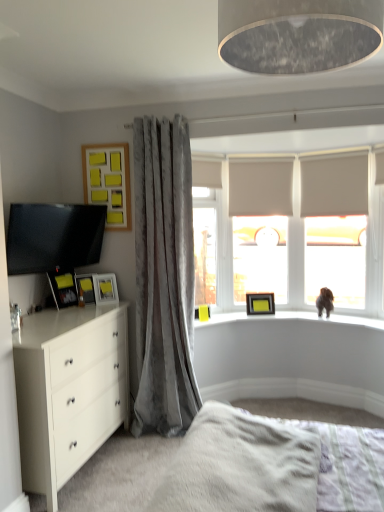
Question: Is matte black tv at left to the right of white fluffy bed at lower center from the viewer's perspective?

Choices:
 (A) yes
 (B) no

Answer: (B)

Question: Does matte black tv at left have a greater height compared to white fluffy bed at lower center?

Choices:
 (A) yes
 (B) no

Answer: (A)

Question: Does matte black tv at left contain white fluffy bed at lower center?

Choices:
 (A) yes
 (B) no

Answer: (B)

Question: From the image's perspective, is matte black tv at left below white fluffy bed at lower center?

Choices:
 (A) yes
 (B) no

Answer: (B)

Question: Is matte black tv at left next to white fluffy bed at lower center and touching it?

Choices:
 (A) yes
 (B) no

Answer: (B)

Question: Considering the positions of velvet gray curtain at left and matte black tv at left in the image, is velvet gray curtain at left wider or thinner than matte black tv at left?

Choices:
 (A) thin
 (B) wide

Answer: (B)

Question: Is point (147, 164) positioned closer to the camera than point (104, 212)?

Choices:
 (A) farther
 (B) closer

Answer: (B)

Question: From a real-world perspective, is velvet gray curtain at left physically located above or below matte black tv at left?

Choices:
 (A) above
 (B) below

Answer: (B)

Question: From the image's perspective, is velvet gray curtain at left positioned above or below matte black tv at left?

Choices:
 (A) above
 (B) below

Answer: (B)

Question: From a real-world perspective, is matte black tv at left above or below matte black picture frame at left, which appears as the fifth picture frame when viewed from the back?

Choices:
 (A) below
 (B) above

Answer: (B)

Question: In the image, is matte black tv at left on the left side or the right side of matte black picture frame at left, positioned as the 1th picture frame in left-to-right order?

Choices:
 (A) right
 (B) left

Answer: (A)

Question: Is matte black tv at left taller or shorter than matte black picture frame at left, which ranks as the first picture frame in front-to-back order?

Choices:
 (A) short
 (B) tall

Answer: (B)

Question: Is point (51, 215) closer or farther from the camera than point (52, 288)?

Choices:
 (A) farther
 (B) closer

Answer: (B)

Question: From the image's perspective, is white fluffy bed at lower center located above or below white glossy chest of drawers at lower left?

Choices:
 (A) below
 (B) above

Answer: (B)

Question: Considering the relative positions of white fluffy bed at lower center and white glossy chest of drawers at lower left in the image provided, is white fluffy bed at lower center to the left or to the right of white glossy chest of drawers at lower left?

Choices:
 (A) left
 (B) right

Answer: (B)